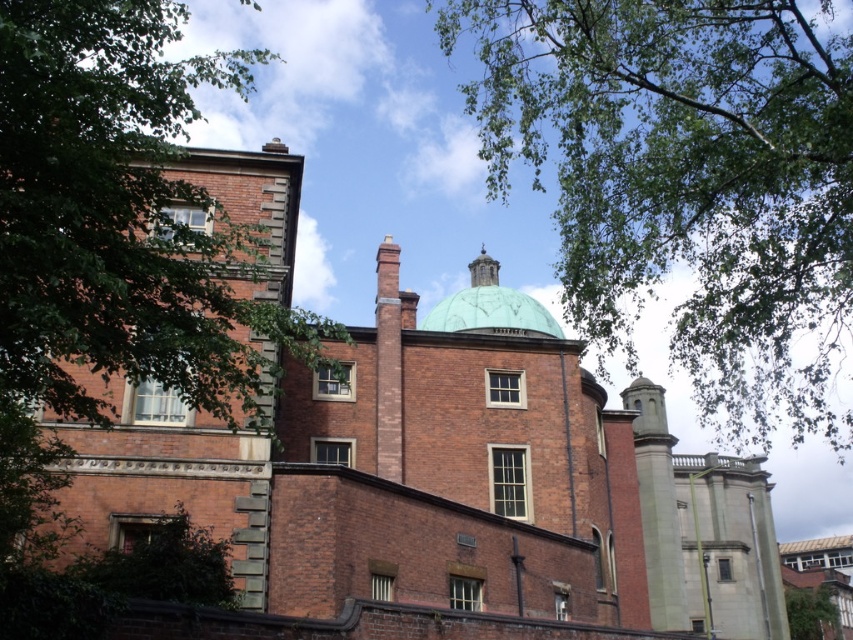
In order to click on green leafy tree at upper center in this screenshot , I will do `click(688, 180)`.

Which is in front, point (602, 209) or point (543, 320)?

Point (602, 209)

Where is `green leafy tree at upper center`? green leafy tree at upper center is located at coordinates (688, 180).

Which is more to the left, green leafy tree at upper center or green leafy tree at lower right?

Positioned to the left is green leafy tree at upper center.

Does green leafy tree at upper center come in front of green leafy tree at lower right?

Yes.

Between point (582, 305) and point (828, 637), which one is positioned in front?

Point (582, 305)

Locate an element on the screen. green leafy tree at upper center is located at coordinates (688, 180).

This screenshot has width=853, height=640. Describe the element at coordinates (490, 307) in the screenshot. I see `green matte dome at center` at that location.

Which is more to the left, green matte dome at center or green leafy tree at lower right?

green matte dome at center

Is point (492, 307) less distant than point (802, 627)?

Yes, point (492, 307) is in front of point (802, 627).

What are the coordinates of `green matte dome at center` in the screenshot? It's located at (490, 307).